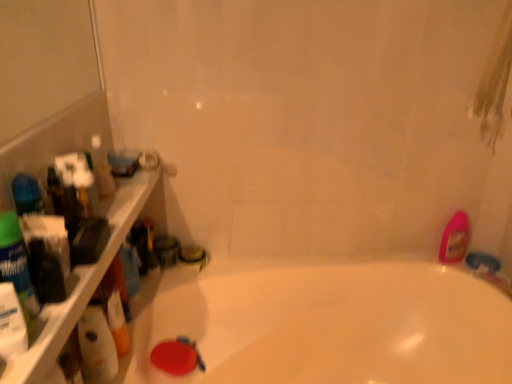
Question: Are white glossy bottle at left and translucent plastic bottles at left located far from each other?

Choices:
 (A) no
 (B) yes

Answer: (A)

Question: Does white glossy bottle at left have a greater width compared to translucent plastic bottles at left?

Choices:
 (A) no
 (B) yes

Answer: (A)

Question: From a real-world perspective, does white glossy bottle at left stand above translucent plastic bottles at left?

Choices:
 (A) no
 (B) yes

Answer: (A)

Question: From the image's perspective, is white glossy bottle at left on top of translucent plastic bottles at left?

Choices:
 (A) yes
 (B) no

Answer: (B)

Question: Is white glossy bottle at left turned away from translucent plastic bottles at left?

Choices:
 (A) no
 (B) yes

Answer: (A)

Question: Is translucent plastic bottles at left in front of or behind white glossy bottle at left in the image?

Choices:
 (A) front
 (B) behind

Answer: (A)

Question: From the image's perspective, is translucent plastic bottles at left located above or below white glossy bottle at left?

Choices:
 (A) below
 (B) above

Answer: (B)

Question: Is translucent plastic bottles at left situated inside white glossy bottle at left or outside?

Choices:
 (A) inside
 (B) outside

Answer: (B)

Question: Visually, is translucent plastic bottles at left positioned to the left or to the right of white glossy bottle at left?

Choices:
 (A) left
 (B) right

Answer: (A)

Question: Considering their positions, is translucent plastic bottles at left located in front of or behind pink glossy bottle at right?

Choices:
 (A) front
 (B) behind

Answer: (A)

Question: Is translucent plastic bottles at left situated inside pink glossy bottle at right or outside?

Choices:
 (A) outside
 (B) inside

Answer: (A)

Question: Is translucent plastic bottles at left to the left or to the right of pink glossy bottle at right in the image?

Choices:
 (A) right
 (B) left

Answer: (B)

Question: Is point (53, 306) closer or farther from the camera than point (458, 235)?

Choices:
 (A) farther
 (B) closer

Answer: (B)

Question: From a real-world perspective, is translucent plastic bottles at left above or below white glossy bathtub at center?

Choices:
 (A) below
 (B) above

Answer: (B)

Question: Looking at the image, does translucent plastic bottles at left seem bigger or smaller compared to white glossy bathtub at center?

Choices:
 (A) big
 (B) small

Answer: (B)